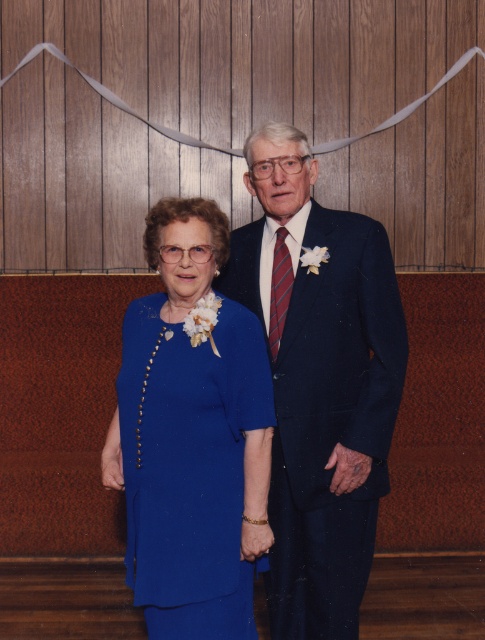
Which of these two, navy wool suit at center or matte blue dress at center, stands taller?

With more height is navy wool suit at center.

Can you confirm if navy wool suit at center is bigger than matte blue dress at center?

Indeed, navy wool suit at center has a larger size compared to matte blue dress at center.

Where is `navy wool suit at center`? The width and height of the screenshot is (485, 640). navy wool suit at center is located at coordinates pyautogui.click(x=320, y=384).

Identify the location of navy wool suit at center. The image size is (485, 640). (320, 384).